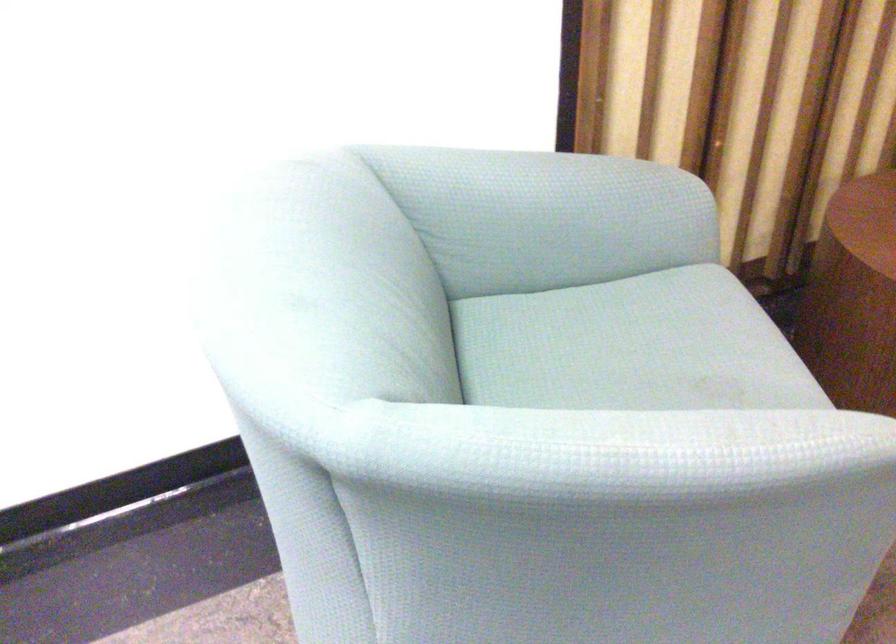
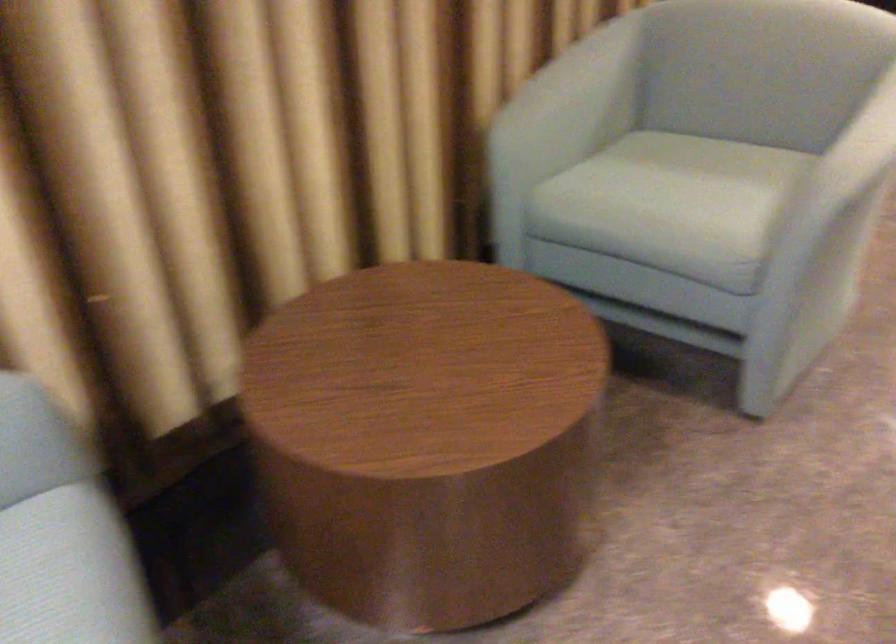
Which direction would the cameraman need to move to produce the second image?

The cameraman walked toward right, forward.